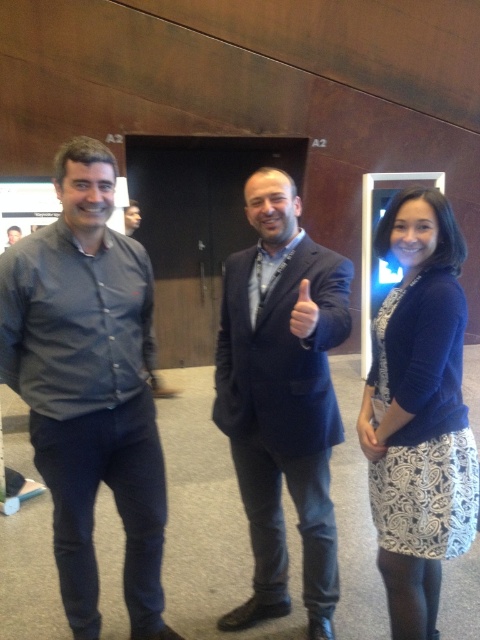
Can you confirm if dark blue sweater at right is wider than matte black shirt at left?

Indeed, dark blue sweater at right has a greater width compared to matte black shirt at left.

Based on the photo, who is more forward, (476, 497) or (20, 234)?

Point (476, 497)

Is point (457, 248) positioned before point (13, 227)?

Yes, point (457, 248) is closer to viewer.

This screenshot has height=640, width=480. I want to click on dark blue sweater at right, so click(x=419, y=412).

Can you confirm if dark gray shirt at left is shorter than dark blue sweater at right?

No.

Is dark gray shirt at left to the left of dark blue sweater at right from the viewer's perspective?

Correct, you'll find dark gray shirt at left to the left of dark blue sweater at right.

Who is more forward, (57, 353) or (402, 216)?

Point (402, 216)

Locate an element on the screen. dark gray shirt at left is located at coordinates (90, 385).

Does dark blue suit at center have a smaller size compared to dark blue sweater at right?

No, dark blue suit at center is not smaller than dark blue sweater at right.

From the picture: Between dark blue suit at center and dark blue sweater at right, which one is positioned lower?

dark blue sweater at right is lower down.

Who is more forward, (255, 216) or (404, 285)?

Point (404, 285)

The width and height of the screenshot is (480, 640). I want to click on dark blue suit at center, so click(x=283, y=397).